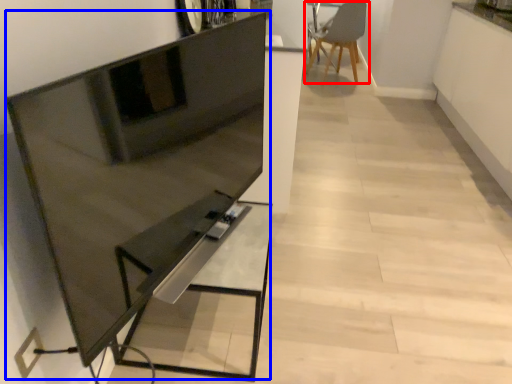
Question: Among these objects, which one is nearest to the camera, chair (highlighted by a red box) or entertainment center (highlighted by a blue box)?

Choices:
 (A) chair
 (B) entertainment center

Answer: (B)